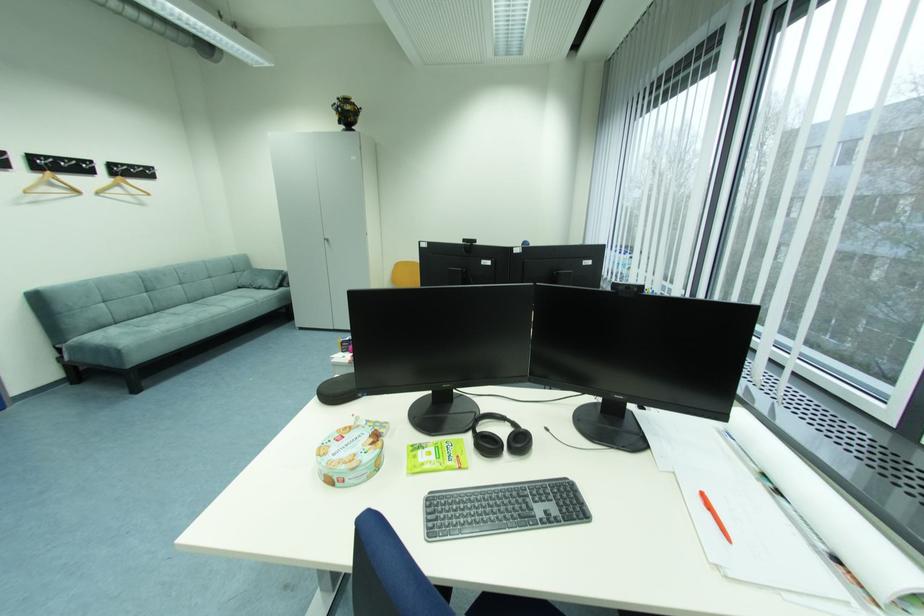
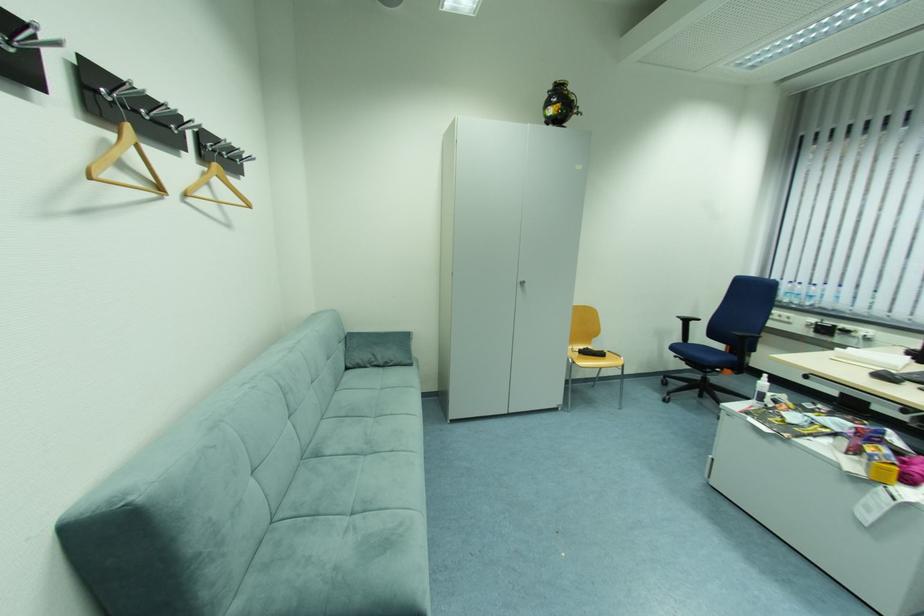
The point at (333, 238) is marked in the first image. Where is the corresponding point in the second image?

(527, 281)